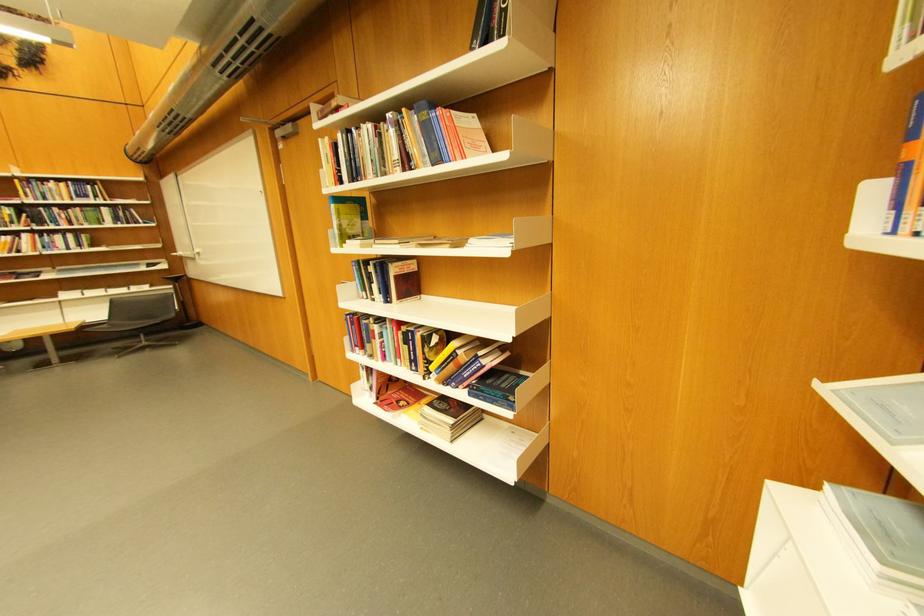
This screenshot has width=924, height=616. What do you see at coordinates (187, 254) in the screenshot?
I see `a silver door handle` at bounding box center [187, 254].